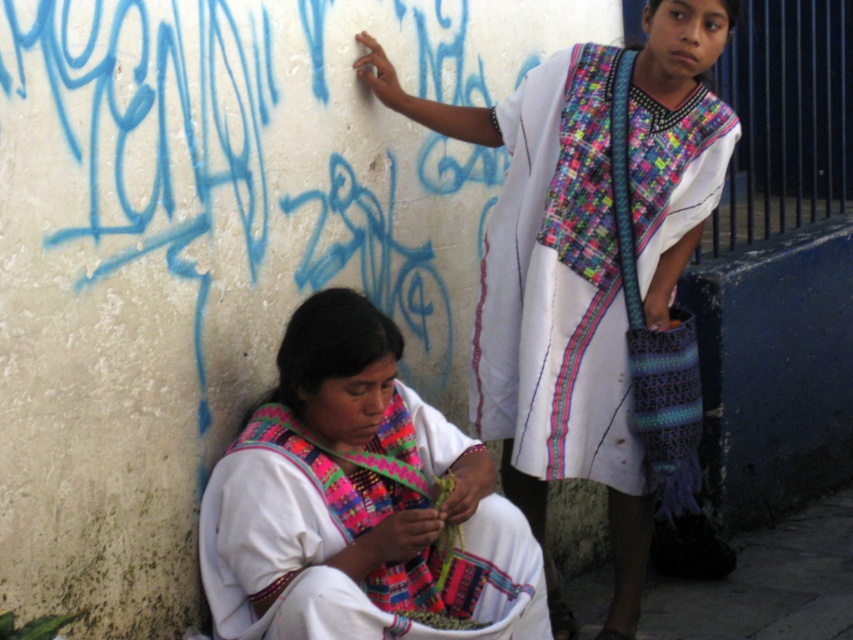
You are a fashion designer observing the scene. You need to decide which garment to use for a new collection that requires a wider piece of fabric. Based on the image, which item would you choose between the white woven fabric dress at upper center and the matte white shawl at lower left?

The white woven fabric dress at upper center has a larger width than the matte white shawl at lower left, so it would be the better choice for the new collection requiring a wider fabric piece.

You are an anthropologist studying traditional attire in urban settings. You observe a white woven fabric dress at upper center in the image. Can you determine its exact position relative to the other objects in the scene?

The white woven fabric dress at upper center is located at point [550,300] according to the provided coordinates.

You are a photographer trying to capture the white woven fabric dress at upper center and the matte white shawl at lower left in the same frame. Which object is covering part of the other?

The white woven fabric dress at upper center is positioned over the matte white shawl at lower left, so it is covering part of the shawl.